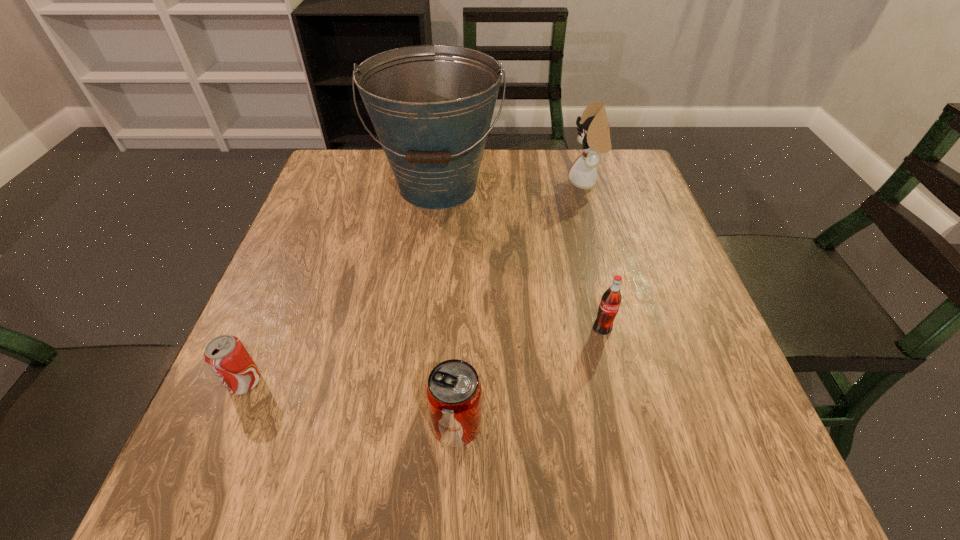
Where is `free space between the third nearest object and the doll`? free space between the third nearest object and the doll is located at coordinates (594, 256).

Locate an element on the screen. The width and height of the screenshot is (960, 540). empty space that is in between the nearest soda can and the third farthest object is located at coordinates (529, 377).

What are the coordinates of `free spot between the doll and the shortest soda can` in the screenshot? It's located at (416, 282).

I want to click on vacant area that lies between the doll and the third nearest object, so click(x=594, y=256).

Where is `vacant point located between the second nearest soda can and the farthest soda can`? The height and width of the screenshot is (540, 960). vacant point located between the second nearest soda can and the farthest soda can is located at coordinates (423, 355).

This screenshot has height=540, width=960. What are the coordinates of `unoccupied position between the bucket and the fourth shortest object` in the screenshot? It's located at click(x=512, y=185).

Where is `empty space between the shortest soda can and the farthest soda can`? empty space between the shortest soda can and the farthest soda can is located at coordinates (423, 355).

Find the location of a particular element. This screenshot has width=960, height=540. free space between the bucket and the second nearest soda can is located at coordinates (342, 285).

Identify the location of empty space that is in between the nearest object and the third farthest object. (529, 377).

Locate an element on the screen. the second closest object to the shortest object is located at coordinates (431, 106).